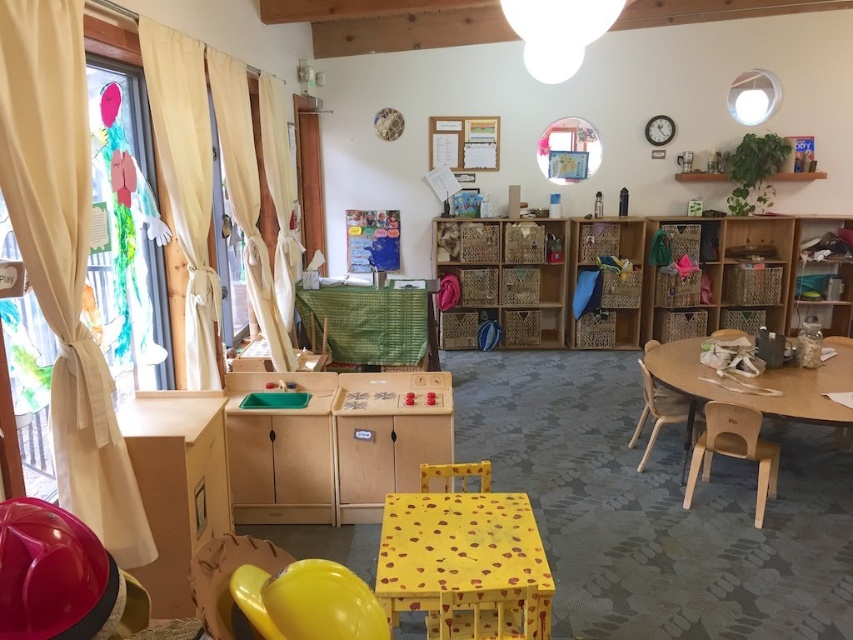
You are standing in the playroom and want to reach both points. Which point, point (381, 588) or point (747, 339), will you reach first if you move directly towards them?

Point (381, 588) is closer to the camera than point (747, 339), so you will reach point (381, 588) first.

You are a parent trying to decide whether to place a new toy box between the yellow matte chair at center and the wooden chair at center. Based on their widths, will there be enough space for the toy box if it requires 1 meter of space between the two chairs?

The yellow matte chair at center might be wider than wooden chair at center, so the space between them may not be sufficient for the toy box requiring 1 meter. Check the actual width before placing the toy box.